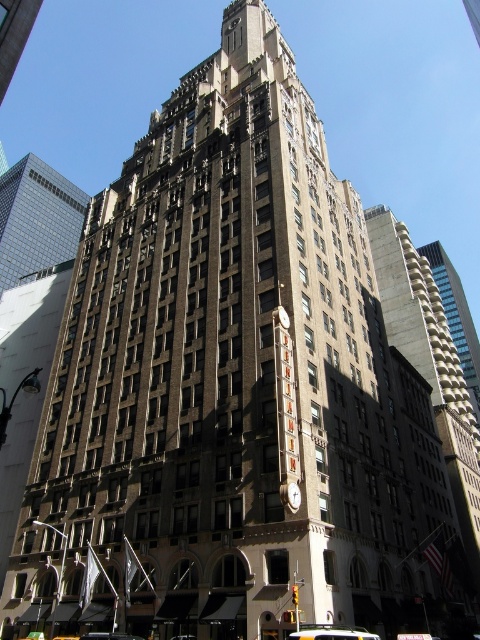
Is brick building at center to the right of yellow rubber taxi at center from the viewer's perspective?

Yes, brick building at center is to the right of yellow rubber taxi at center.

Who is lower down, brick building at center or yellow rubber taxi at center?

yellow rubber taxi at center is lower down.

Which is in front, point (478, 397) or point (315, 625)?

Point (315, 625)

You are a GUI agent. You are given a task and a screenshot of the screen. Output one action in this format:
    pyautogui.click(x=<x>, y=<y>)
    Task: Click on the brick building at center
    
    Given the screenshot: What is the action you would take?
    pyautogui.click(x=456, y=316)

Is glassy reflective skyscraper at upper left to the right of brick building at center from the viewer's perspective?

Incorrect, glassy reflective skyscraper at upper left is not on the right side of brick building at center.

Who is more forward, (0, 266) or (478, 406)?

Point (478, 406) is more forward.

Is point (4, 216) closer to viewer compared to point (458, 339)?

No, (4, 216) is behind (458, 339).

Find the location of a particular element. Image resolution: width=480 pixels, height=640 pixels. glassy reflective skyscraper at upper left is located at coordinates (36, 220).

Does brick building at center lie behind metallic clock at center?

Yes, brick building at center is further from the viewer.

Between brick building at center and metallic clock at center, which one is positioned lower?

metallic clock at center is lower down.

Is point (465, 332) positioned behind point (298, 496)?

Yes, it is behind point (298, 496).

Locate an element on the screen. brick building at center is located at coordinates (456, 316).